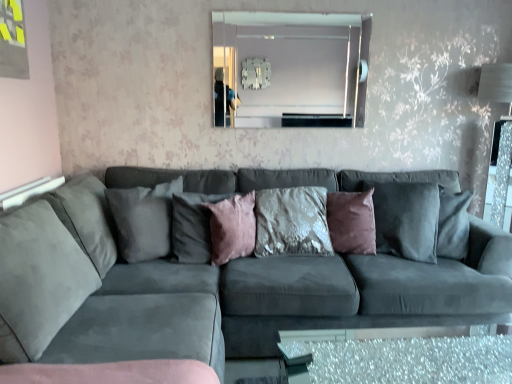
Question: Considering the relative sizes of clear glass mirror at upper center and velvet textured pillow at center, the fourth pillow positioned from the left, in the image provided, is clear glass mirror at upper center bigger than velvet textured pillow at center, the fourth pillow positioned from the left,?

Choices:
 (A) no
 (B) yes

Answer: (A)

Question: Can you confirm if clear glass mirror at upper center is positioned to the right of velvet textured pillow at center, the fourth pillow positioned from the left?

Choices:
 (A) yes
 (B) no

Answer: (B)

Question: Is clear glass mirror at upper center facing away from velvet textured pillow at center, placed as the first pillow when sorted from right to left?

Choices:
 (A) no
 (B) yes

Answer: (A)

Question: From the image's perspective, does clear glass mirror at upper center appear higher than velvet textured pillow at center, the fourth pillow positioned from the left?

Choices:
 (A) no
 (B) yes

Answer: (B)

Question: Is the depth of clear glass mirror at upper center greater than that of velvet textured pillow at center, the fourth pillow positioned from the left?

Choices:
 (A) yes
 (B) no

Answer: (A)

Question: Would you say velvet textured pillow at center, placed as the first pillow when sorted from right to left, is inside or outside pink velvet cushion at center, the second pillow viewed from the right?

Choices:
 (A) outside
 (B) inside

Answer: (A)

Question: From the image's perspective, is velvet textured pillow at center, the fourth pillow positioned from the left, located above or below pink velvet cushion at center, the 3th pillow viewed from the left?

Choices:
 (A) below
 (B) above

Answer: (B)

Question: Is velvet textured pillow at center, placed as the first pillow when sorted from right to left, taller or shorter than pink velvet cushion at center, the second pillow viewed from the right?

Choices:
 (A) tall
 (B) short

Answer: (A)

Question: Considering the positions of point (373, 233) and point (225, 208), is point (373, 233) closer or farther from the camera than point (225, 208)?

Choices:
 (A) farther
 (B) closer

Answer: (A)

Question: Is point (206, 233) positioned closer to the camera than point (336, 198)?

Choices:
 (A) closer
 (B) farther

Answer: (A)

Question: Is pink velvet pillow at center, the 3th pillow viewed from the right, inside or outside of velvet textured pillow at center, the fourth pillow positioned from the left?

Choices:
 (A) outside
 (B) inside

Answer: (A)

Question: In the image, is pink velvet pillow at center, the 3th pillow viewed from the right, on the left side or the right side of velvet textured pillow at center, placed as the first pillow when sorted from right to left?

Choices:
 (A) left
 (B) right

Answer: (A)

Question: Is pink velvet pillow at center, the 3th pillow viewed from the right, taller or shorter than velvet textured pillow at center, the fourth pillow positioned from the left?

Choices:
 (A) tall
 (B) short

Answer: (B)

Question: Is clear glass mirror at upper center inside or outside of suede gray couch at center?

Choices:
 (A) outside
 (B) inside

Answer: (A)

Question: Does point (310, 72) appear closer or farther from the camera than point (152, 334)?

Choices:
 (A) farther
 (B) closer

Answer: (A)